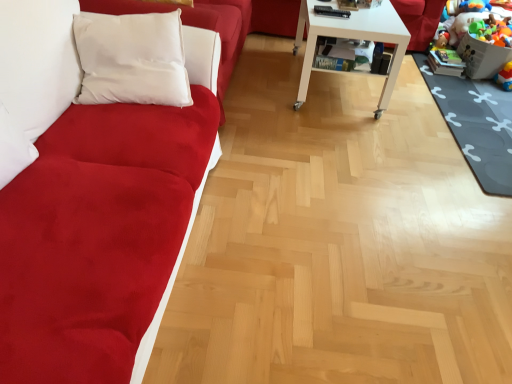
Question: From a real-world perspective, is white glossy table at center above or below suede-like red couch at left?

Choices:
 (A) below
 (B) above

Answer: (A)

Question: Considering the relative positions of white glossy table at center and suede-like red couch at left in the image provided, is white glossy table at center to the left or to the right of suede-like red couch at left?

Choices:
 (A) right
 (B) left

Answer: (A)

Question: Based on their relative distances, which object is nearer to the white glossy table at center?

Choices:
 (A) plush multicolored toys at lower right, acting as the 1th toy starting from the top
 (B) suede-like red couch at left
 (C) dark gray rubber mat at lower right
 (D) rubberized plastic toy at lower right, which is counted as the second toy, starting from the top

Answer: (C)

Question: Estimate the real-world distances between objects in this image. Which object is farther from the suede-like red couch at left?

Choices:
 (A) white glossy table at center
 (B) dark gray rubber mat at lower right
 (C) rubberized plastic toy at lower right, which appears as the first toy when ordered from the bottom
 (D) plush multicolored toys at lower right, acting as the 1th toy starting from the top

Answer: (C)